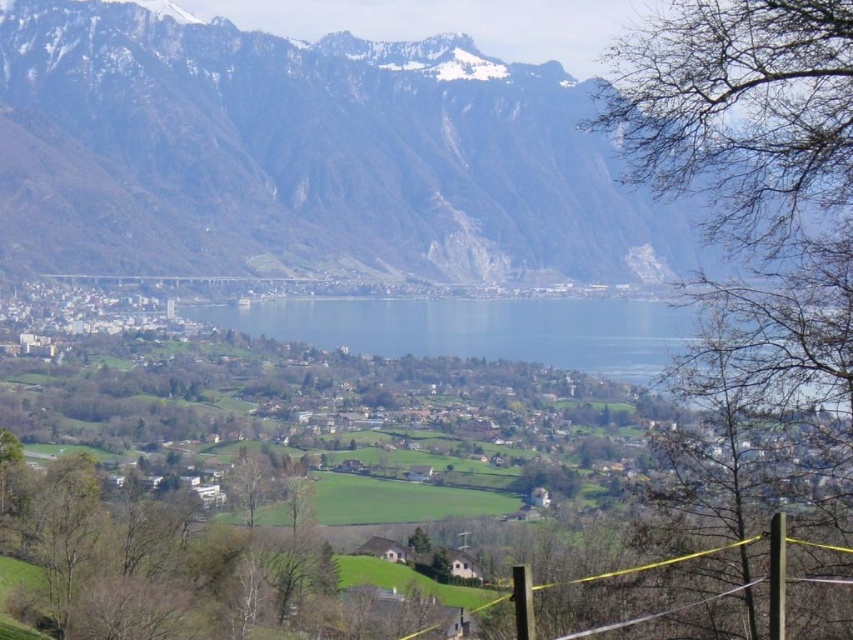
Question: Does rocky gray mountain at upper center appear on the left side of yellow string at lower right?

Choices:
 (A) no
 (B) yes

Answer: (B)

Question: Can you confirm if clear blue water at center is thinner than yellow string at lower right?

Choices:
 (A) no
 (B) yes

Answer: (A)

Question: Which of these objects is positioned farthest from the rocky gray mountain at upper center?

Choices:
 (A) yellow string at lower right
 (B) clear blue water at center

Answer: (A)

Question: Which of the following is the closest to the observer?

Choices:
 (A) rocky gray mountain at upper center
 (B) yellow string at lower right
 (C) clear blue water at center

Answer: (B)

Question: Where is clear blue water at center located in relation to yellow string at lower right in the image?

Choices:
 (A) right
 (B) left

Answer: (B)

Question: Based on their relative distances, which object is nearer to the yellow string at lower right?

Choices:
 (A) clear blue water at center
 (B) rocky gray mountain at upper center

Answer: (A)